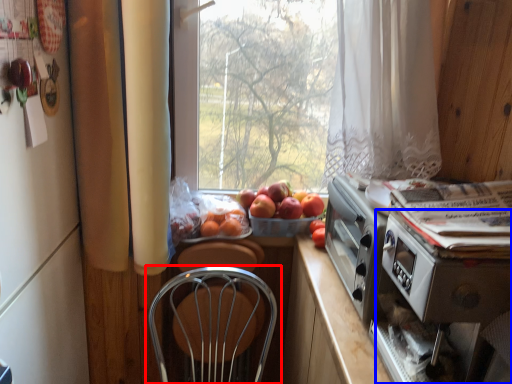
Question: Which point is closer to the camera, chair (highlighted by a red box) or appliance (highlighted by a blue box)?

Choices:
 (A) chair
 (B) appliance

Answer: (B)